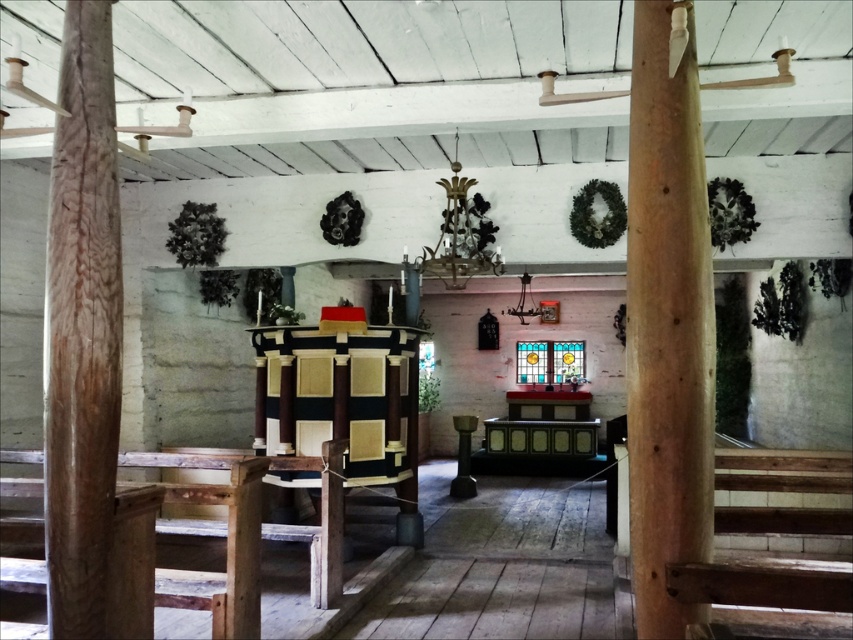
Question: Can you confirm if smooth light brown wooden pillar at center is thinner than brown wood pillar at left?

Choices:
 (A) yes
 (B) no

Answer: (A)

Question: Which point appears farthest from the camera in this image?

Choices:
 (A) (102, 416)
 (B) (669, 284)

Answer: (A)

Question: Among these points, which one is nearest to the camera?

Choices:
 (A) (67, 449)
 (B) (704, 476)

Answer: (B)

Question: Is smooth light brown wooden pillar at center closer to camera compared to brown wood pillar at left?

Choices:
 (A) no
 (B) yes

Answer: (B)

Question: Is smooth light brown wooden pillar at center bigger than brown wood pillar at left?

Choices:
 (A) no
 (B) yes

Answer: (B)